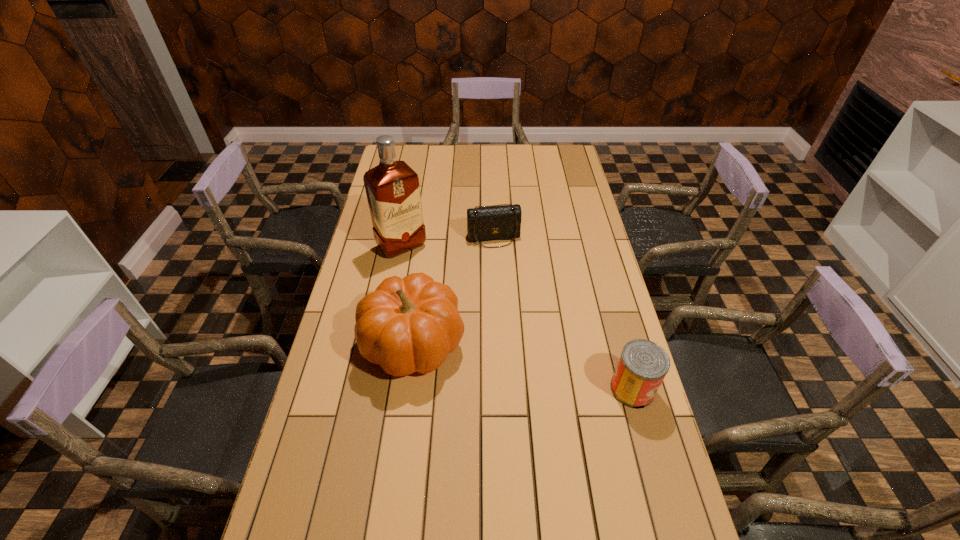
Where is `vacant space located 0.130m on the front flap of the clutch bag`? The width and height of the screenshot is (960, 540). vacant space located 0.130m on the front flap of the clutch bag is located at coordinates (505, 272).

Where is `vacant space located on the front flap of the clutch bag`? This screenshot has height=540, width=960. vacant space located on the front flap of the clutch bag is located at coordinates point(509,288).

Find the location of a particular element. pumpkin at the left edge is located at coordinates (410, 324).

At what (x,y) coordinates should I click in order to perform the action: click on liquor that is positioned at the left edge. Please return your answer as a coordinate pair (x, y). Image resolution: width=960 pixels, height=540 pixels. Looking at the image, I should click on (392, 187).

Find the location of a particular element. This screenshot has height=540, width=960. object that is at the right edge is located at coordinates (643, 364).

The width and height of the screenshot is (960, 540). Identify the location of blank area at the far edge. (438, 171).

The height and width of the screenshot is (540, 960). Identify the location of vacant region at the near edge. 596,505.

What are the coordinates of `free space at the right edge` in the screenshot? It's located at (546, 190).

Identify the location of free region at the far right corner of the desktop. (553, 147).

Where is `vacant area between the clutch bag and the pumpkin`? This screenshot has height=540, width=960. vacant area between the clutch bag and the pumpkin is located at coordinates (453, 290).